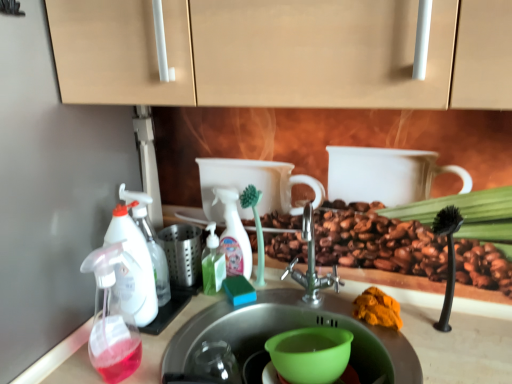
Identify the location of vacant area to the right of translucent plastic spray bottle at center. (301, 298).